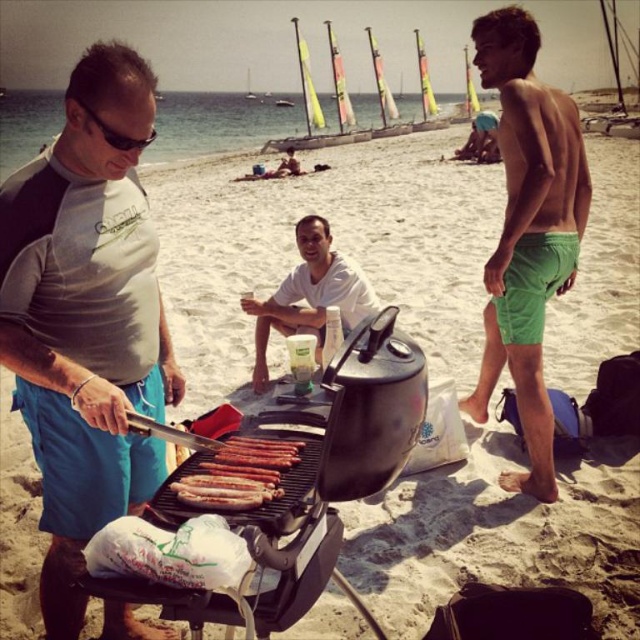
Can you confirm if gray-blue rash guard at left is positioned to the left of white matte shirt at center?

Indeed, gray-blue rash guard at left is positioned on the left side of white matte shirt at center.

Can you confirm if gray-blue rash guard at left is shorter than white matte shirt at center?

In fact, gray-blue rash guard at left may be taller than white matte shirt at center.

This screenshot has height=640, width=640. What do you see at coordinates (84, 320) in the screenshot?
I see `gray-blue rash guard at left` at bounding box center [84, 320].

Find the location of a particular element. gray-blue rash guard at left is located at coordinates (84, 320).

Is gray-blue rash guard at left to the right of black plastic goggles at upper left from the viewer's perspective?

In fact, gray-blue rash guard at left is to the left of black plastic goggles at upper left.

Measure the distance between point (52, 381) and camera.

They are 7.13 feet apart.

Where is `gray-blue rash guard at left`? The width and height of the screenshot is (640, 640). gray-blue rash guard at left is located at coordinates (84, 320).

Can you confirm if gray-blue rash guard at left is bigger than green cotton shorts at right?

Actually, gray-blue rash guard at left might be smaller than green cotton shorts at right.

Is point (113, 285) closer to viewer compared to point (515, 253)?

That is True.

Identify the location of gray-blue rash guard at left. (84, 320).